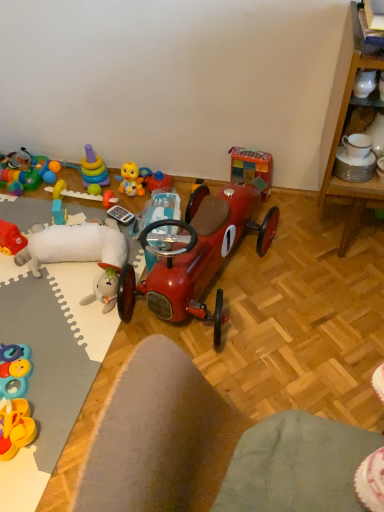
Question: Looking at the image, does wooden block tower at upper right, the first toy in the right-to-left sequence, seem bigger or smaller compared to shiny red car at center, the second toy from the right?

Choices:
 (A) small
 (B) big

Answer: (A)

Question: From a real-world perspective, is wooden block tower at upper right, the eleventh toy viewed from the left, physically located above or below shiny red car at center, the second toy from the right?

Choices:
 (A) above
 (B) below

Answer: (B)

Question: Which of these objects is positioned closest to the rubberized multicolored ball at left, which is counted as the 11th toy, starting from the right?

Choices:
 (A) shiny metallic car at center, placed as the third toy when sorted from right to left
 (B) yellow rubber duck at upper center, marked as the fourth toy in a right-to-left arrangement
 (C) wooden cabinet at right
 (D) rubberized plastic toy at center, placed as the 6th toy when sorted from left to right
 (E) wooden table at lower center

Answer: (D)

Question: Which object is positioned farthest from the shiny red car at center, the second toy from the right?

Choices:
 (A) wooden block tower at upper right, the first toy in the right-to-left sequence
 (B) translucent plastic block at upper left, which is the 9th toy in right-to-left order
 (C) rubber duck at left, which is counted as the second toy, starting from the left
 (D) shiny metallic car at center, the 9th toy positioned from the left
 (E) rubberized multicolored ball at left, acting as the 1th toy starting from the left

Answer: (E)